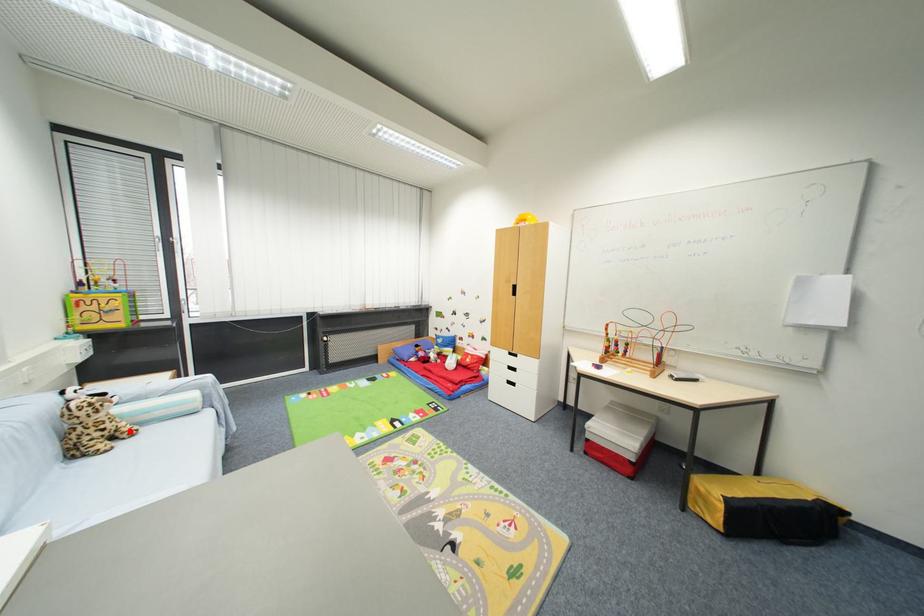
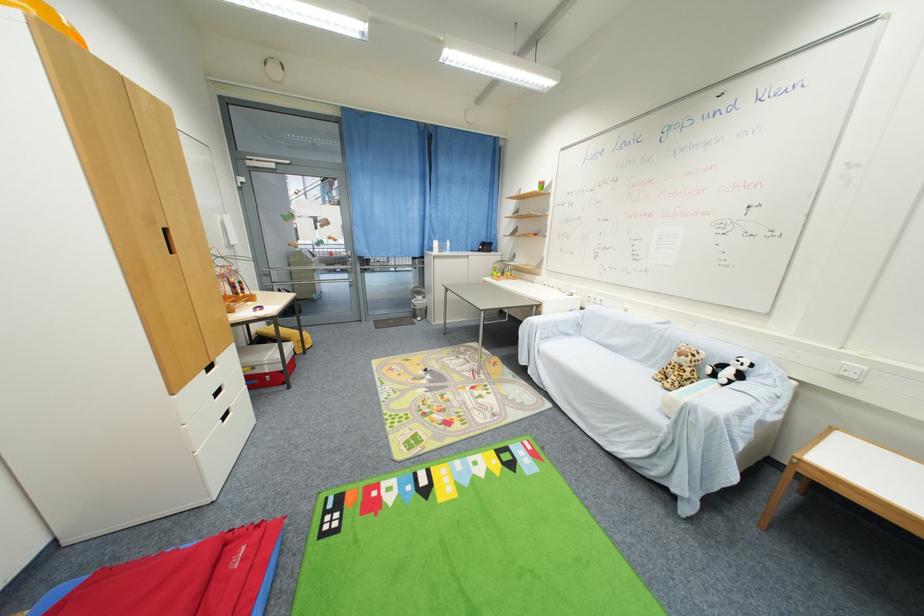
In the second image, find the point that corresponds to the highlighted location in the first image.

(675, 382)